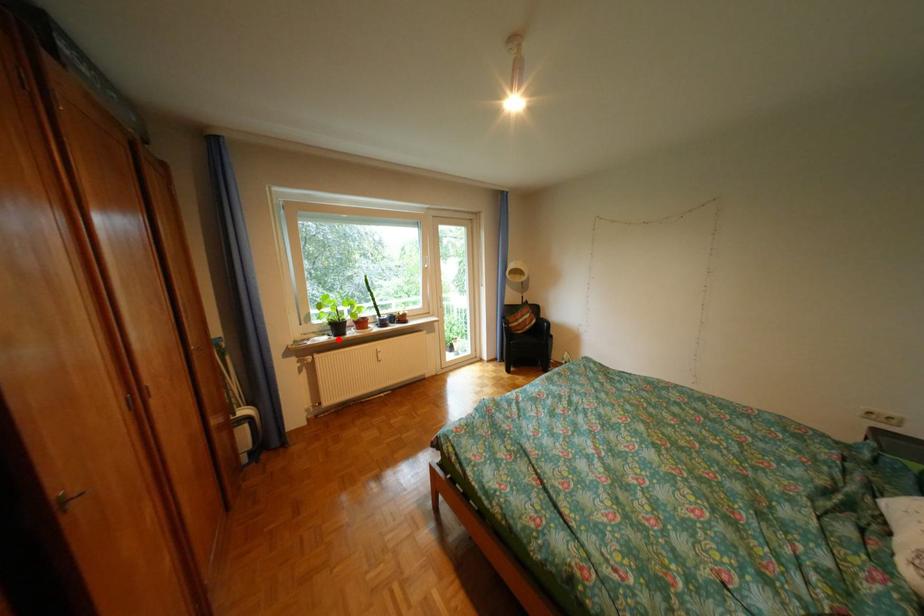
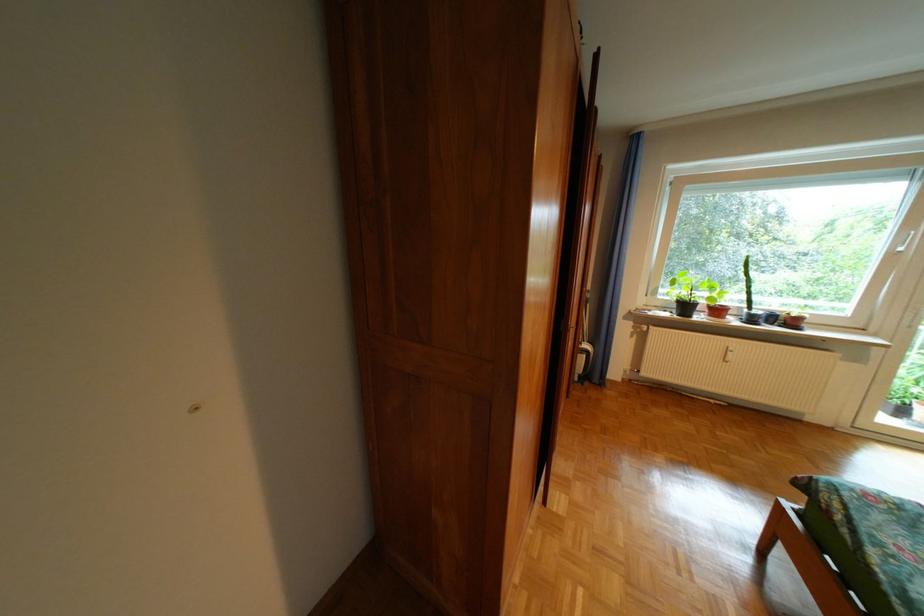
Locate, in the second image, the point that corresponds to the highlighted location in the first image.

(679, 315)